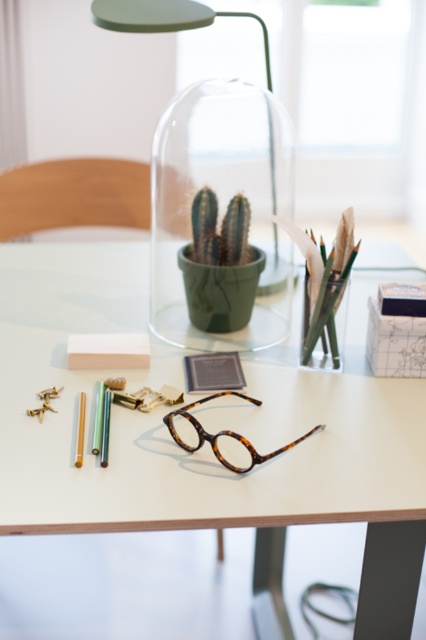
You have a small box that can only hold items narrower than the pastel green matte crayon at lower left. Can you fit the tortoiseshell glasses at center into the box?

The tortoiseshell glasses at center are wider than the pastel green matte crayon at lower left, so they cannot fit into the box designed for items narrower than the crayon.

You are organizing items on the desk and need to place both the green matte lampshade at center and the tortoiseshell glasses at center. According to their current positions, which item is located to the left?

The green matte lampshade at center is positioned on the left side of the tortoiseshell glasses at center, so it is located to the left.

You are organizing items on a desk and notice two pairs of tortoiseshell eyewear. One is labeled as tortoiseshell eyeglasses at center and the other as tortoiseshell glasses at center. According to the image, which one is positioned higher?

The tortoiseshell eyeglasses at center is above the tortoiseshell glasses at center, so the tortoiseshell eyeglasses at center is positioned higher.